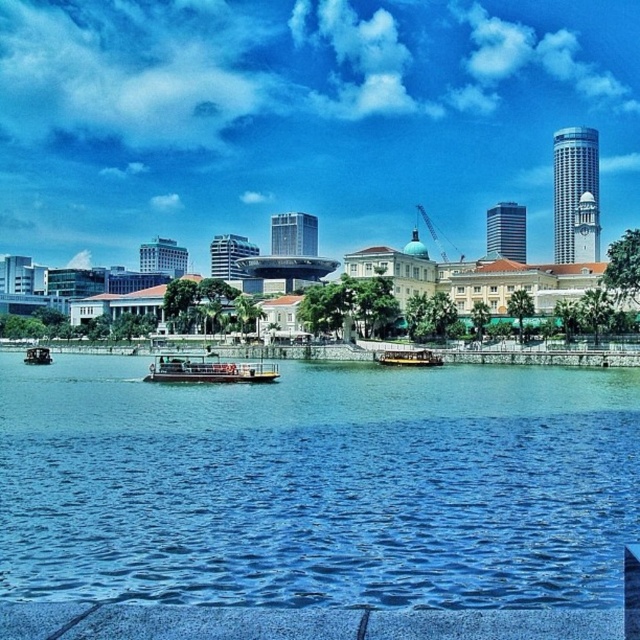
Does blue water at center appear under wooden polished boat at center?

Correct, blue water at center is located below wooden polished boat at center.

From the picture: Is blue water at center positioned in front of wooden polished boat at center?

That is True.

Which is behind, point (220, 429) or point (396, 353)?

Positioned behind is point (396, 353).

The image size is (640, 640). What are the coordinates of `blue water at center` in the screenshot? It's located at (317, 484).

Does blue water at center have a smaller size compared to yellow matte boat at center?

Incorrect, blue water at center is not smaller in size than yellow matte boat at center.

This screenshot has width=640, height=640. What do you see at coordinates (317, 484) in the screenshot?
I see `blue water at center` at bounding box center [317, 484].

You are a GUI agent. You are given a task and a screenshot of the screen. Output one action in this format:
    pyautogui.click(x=<x>, y=<y>)
    Task: Click on the blue water at center
    The image size is (640, 640).
    Given the screenshot: What is the action you would take?
    pyautogui.click(x=317, y=484)

At what (x,y) coordinates should I click in order to perform the action: click on blue water at center. Please return your answer as a coordinate pair (x, y). Looking at the image, I should click on (317, 484).

Which is behind, point (403, 353) or point (35, 362)?

Positioned behind is point (35, 362).

At what (x,y) coordinates should I click in order to perform the action: click on wooden polished boat at center. Please return your answer as a coordinate pair (x, y). This screenshot has height=640, width=640. Looking at the image, I should click on click(x=408, y=356).

Who is more distant from viewer, (420, 362) or (38, 358)?

The point (38, 358) is behind.

Find the location of a particular element. wooden polished boat at center is located at coordinates (408, 356).